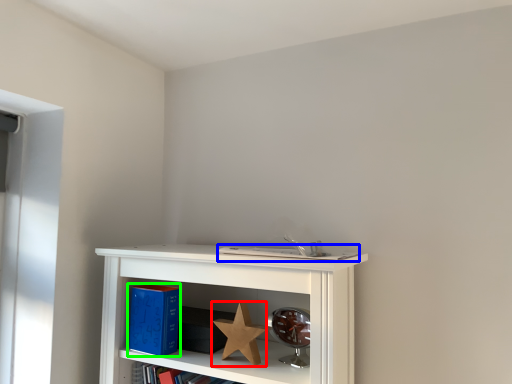
Question: Based on their relative distances, which object is farther from star (highlighted by a red box)? Choose from book (highlighted by a blue box) and paperback book (highlighted by a green box).

Choices:
 (A) book
 (B) paperback book

Answer: (A)